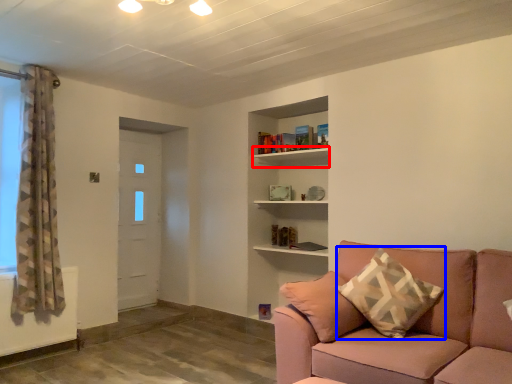
Question: Which of the following is the farthest to the observer, shelf (highlighted by a red box) or pillow (highlighted by a blue box)?

Choices:
 (A) shelf
 (B) pillow

Answer: (A)